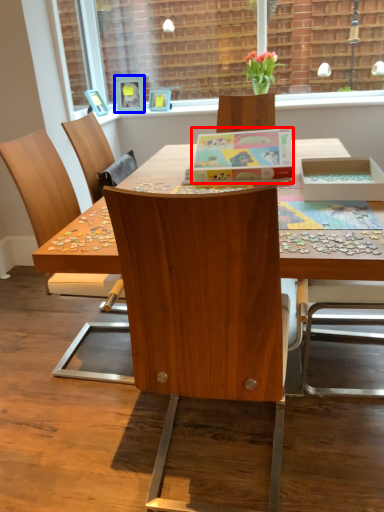
Question: Which of the following is the farthest to the observer, box (highlighted by a red box) or picture frame (highlighted by a blue box)?

Choices:
 (A) box
 (B) picture frame

Answer: (B)